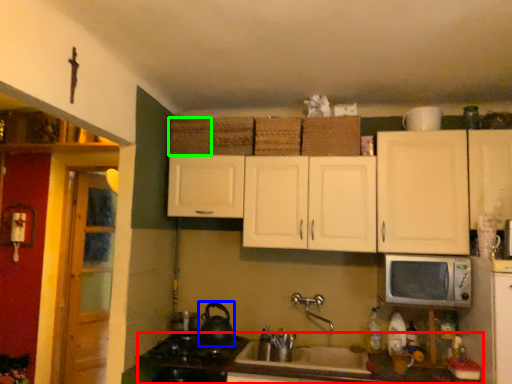
Question: Which object is positioned closest to countertop (highlighted by a red box)? Select from tea pot (highlighted by a blue box) and basket (highlighted by a green box).

Choices:
 (A) tea pot
 (B) basket

Answer: (A)